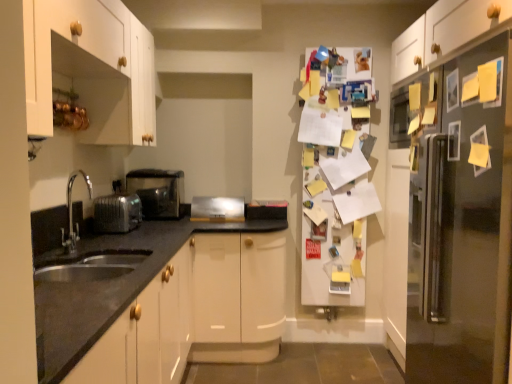
Question: Does point (26, 19) appear closer or farther from the camera than point (118, 274)?

Choices:
 (A) farther
 (B) closer

Answer: (B)

Question: From a real-world perspective, is white wood cabinet at upper left physically located above or below satin nickel faucet at lower left?

Choices:
 (A) below
 (B) above

Answer: (B)

Question: Which object is positioned farthest from the satin silver toaster at lower left, positioned as the third appliance in right-to-left order?

Choices:
 (A) white wood cabinet at upper left
 (B) satin silver toaster at lower left, which is the first appliance in back-to-front order
 (C) satin silver toaster at center, the 1th appliance from the right
 (D) satin silver refrigerator at right, which is counted as the second fridge, starting from the left
 (E) satin nickel faucet at lower left

Answer: (D)

Question: Which is farther from the satin nickel faucet at lower left?

Choices:
 (A) white wood cabinet at upper left
 (B) satin silver toaster at lower left, positioned as the 1th appliance in front-to-back order
 (C) satin silver toaster at lower left, which appears as the second appliance when viewed from the left
 (D) satin silver refrigerator at right, the first fridge positioned from the right
 (E) satin silver toaster at center, the 1th appliance from the right

Answer: (D)